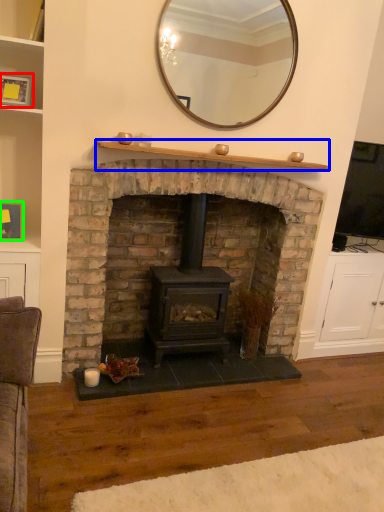
Question: Based on their relative distances, which object is nearer to picture frame (highlighted by a red box)? Choose from mantle (highlighted by a blue box) and picture frame (highlighted by a green box).

Choices:
 (A) mantle
 (B) picture frame

Answer: (B)